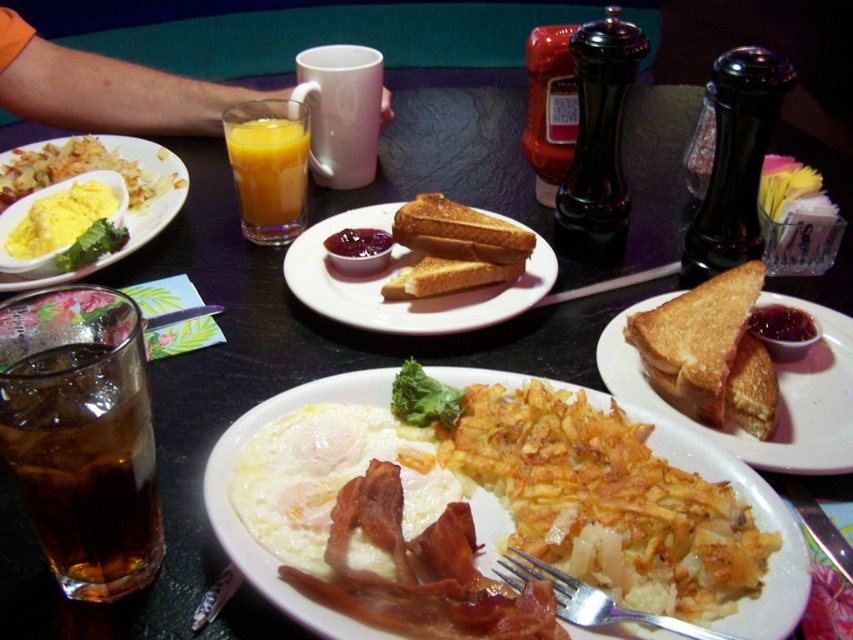
You are a food critic sitting at the table in the image. You want to reach for the white fried egg at center without moving your chair. Can you comfortably do so while keeping your arm extended?

The white fried egg at center is 11.66 inches away from the camera, which is a comfortable distance for reaching without moving your chair. Yes, you can comfortably reach it with your arm extended.

You are a diner customer who wants to grab the yellow matte egg at upper left and the matte yellow eggs at center. The server warned you that the eggs are hot. To avoid burning your fingers, you need to know which egg is closer to the edge of the plate. Which one is closer?

The yellow matte egg at upper left is closer to the edge of the plate since it is only 2.25 inches away from the matte yellow eggs at center, but the exact distance to the edge isn